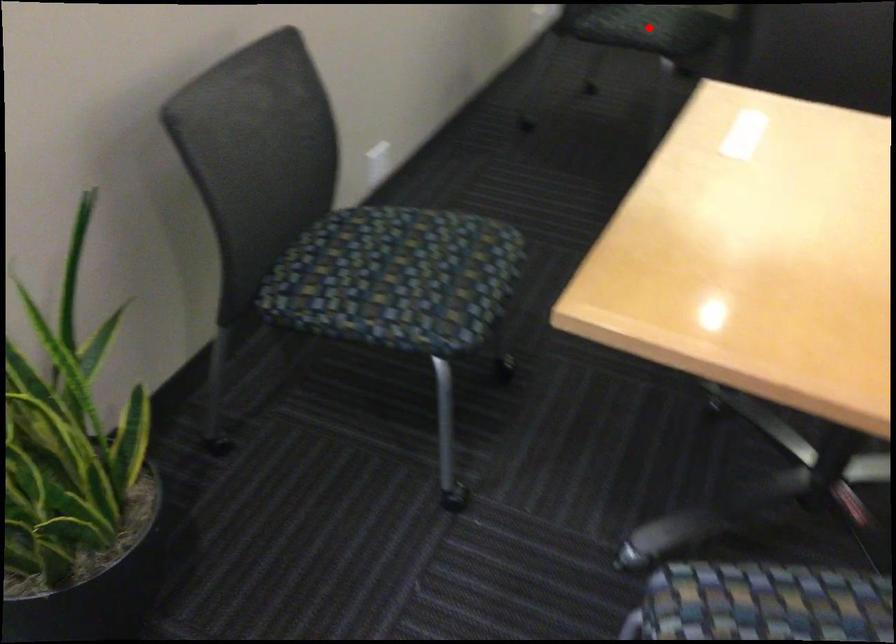
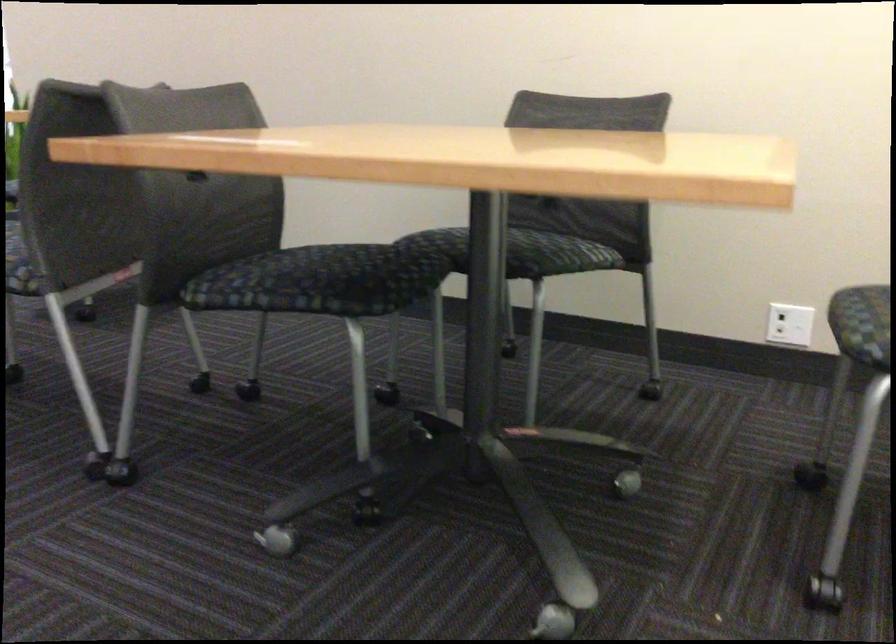
Question: I am providing you with two images of the same scene from different viewpoints. A red point is marked on the first image. Is the red point's position out of view in image 2?

Choices:
 (A) Yes
 (B) No

Answer: (A)